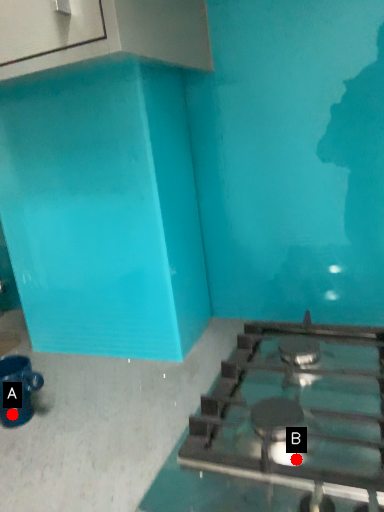
Question: Two points are circled on the image, labeled by A and B beside each circle. Which point appears farthest from the camera in this image?

Choices:
 (A) A is further
 (B) B is further

Answer: (A)